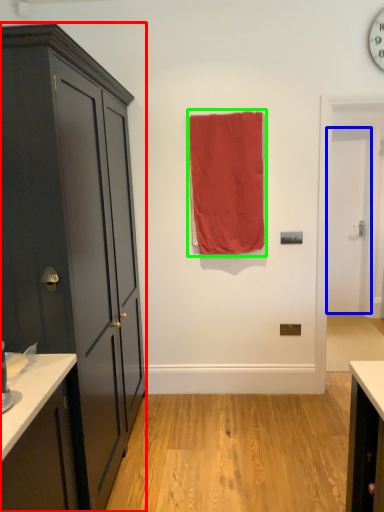
Question: Which object is the closest to the cabinetry (highlighted by a red box)? Choose among these: door (highlighted by a blue box) or curtain (highlighted by a green box).

Choices:
 (A) door
 (B) curtain

Answer: (B)